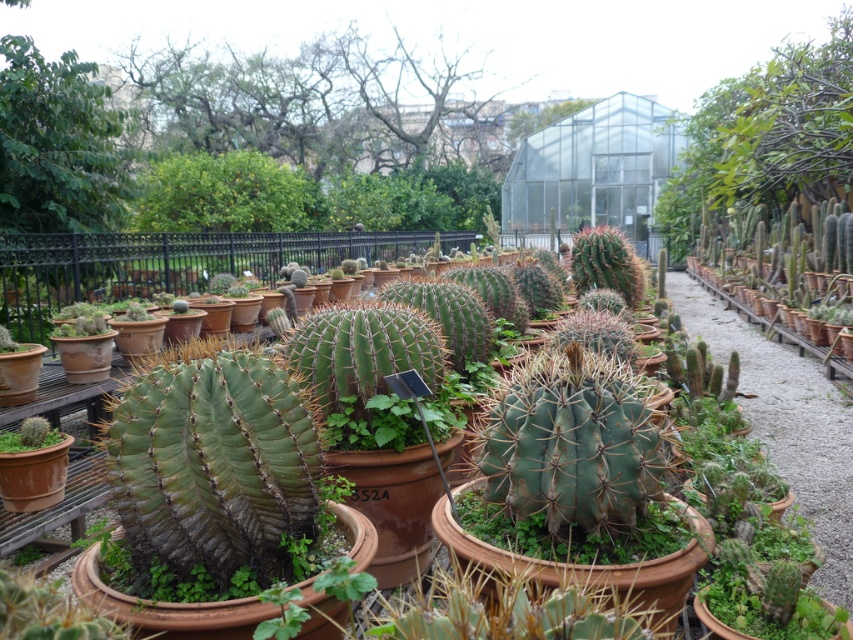
Is green matte cactus at center taller than green matte cactus at lower left?

Correct, green matte cactus at center is much taller as green matte cactus at lower left.

Is green matte cactus at center smaller than green matte cactus at lower left?

Actually, green matte cactus at center might be larger than green matte cactus at lower left.

Find the location of a particular element. green matte cactus at center is located at coordinates (788, 422).